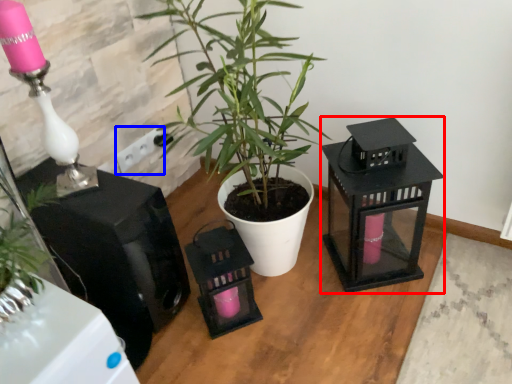
Question: Which object is further to the camera taking this photo, appliance (highlighted by a red box) or electric outlet (highlighted by a blue box)?

Choices:
 (A) appliance
 (B) electric outlet

Answer: (B)